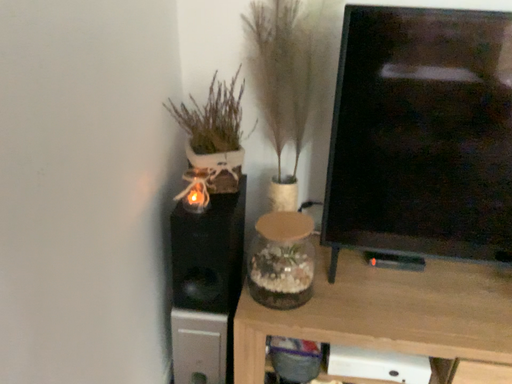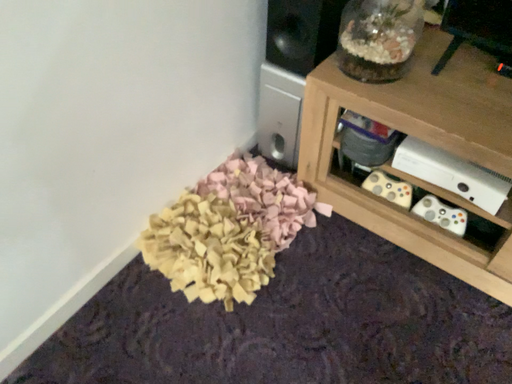
Question: How did the camera likely rotate when shooting the video?

Choices:
 (A) rotated upward
 (B) rotated downward

Answer: (B)